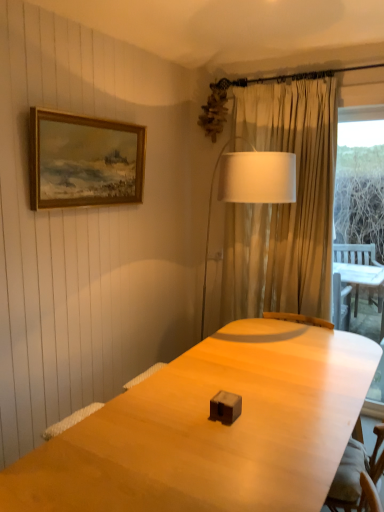
Question: From a real-world perspective, is white fabric lampshade at center above or below wooden framed painting at upper left?

Choices:
 (A) below
 (B) above

Answer: (A)

Question: Based on their positions, is white fabric lampshade at center located to the left or right of wooden framed painting at upper left?

Choices:
 (A) left
 (B) right

Answer: (B)

Question: From the image's perspective, is white fabric lampshade at center located above or below wooden framed painting at upper left?

Choices:
 (A) below
 (B) above

Answer: (A)

Question: From the image's perspective, relative to white fabric lampshade at center, is wooden framed painting at upper left above or below?

Choices:
 (A) below
 (B) above

Answer: (B)

Question: In terms of height, does wooden framed painting at upper left look taller or shorter compared to white fabric lampshade at center?

Choices:
 (A) tall
 (B) short

Answer: (B)

Question: Visually, is wooden framed painting at upper left positioned to the left or to the right of white fabric lampshade at center?

Choices:
 (A) right
 (B) left

Answer: (B)

Question: Considering their positions, is wooden framed painting at upper left located in front of or behind white fabric lampshade at center?

Choices:
 (A) behind
 (B) front

Answer: (B)